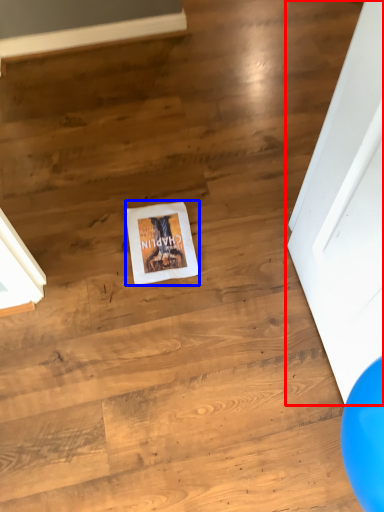
Question: Which object is closer to the camera taking this photo, door (highlighted by a red box) or flyer (highlighted by a blue box)?

Choices:
 (A) door
 (B) flyer

Answer: (A)